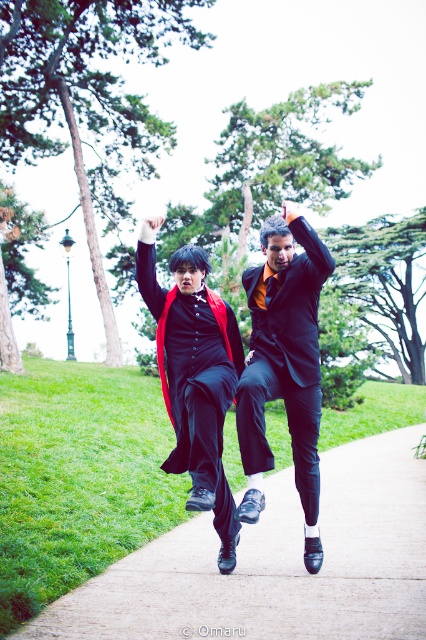
Question: In this image, where is paved concrete at center located relative to velvet red cape at center?

Choices:
 (A) below
 (B) above

Answer: (A)

Question: Among these objects, which one is nearest to the camera?

Choices:
 (A) shiny black suit at center
 (B) velvet red cape at center
 (C) paved concrete at center

Answer: (C)

Question: Is shiny black suit at center further to camera compared to velvet red cape at center?

Choices:
 (A) yes
 (B) no

Answer: (B)

Question: Can you confirm if paved concrete at center is smaller than velvet red cape at center?

Choices:
 (A) no
 (B) yes

Answer: (A)

Question: Which object is positioned closest to the velvet red cape at center?

Choices:
 (A) shiny black suit at center
 (B) paved concrete at center

Answer: (A)

Question: Which point is farther from the camera taking this photo?

Choices:
 (A) (195, 356)
 (B) (317, 604)

Answer: (A)